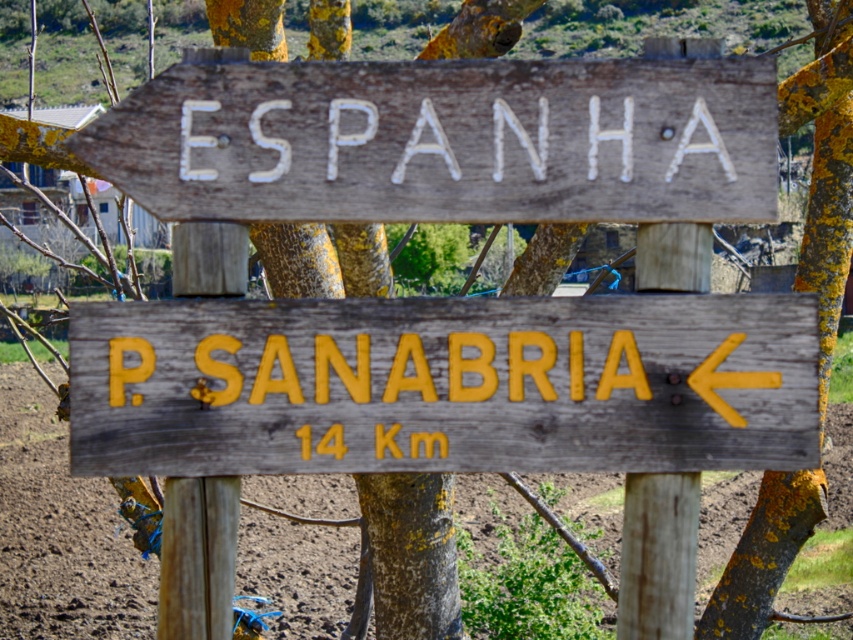
Between point (132, 356) and point (206, 164), which one is positioned in front?

Point (132, 356)

Does yellow painted wood sign at center appear over wooden sign at upper center?

Actually, yellow painted wood sign at center is below wooden sign at upper center.

Is point (772, 349) more distant than point (354, 129)?

Yes.

Find the location of a particular element. yellow painted wood sign at center is located at coordinates (444, 385).

Looking at this image, who is higher up, wooden sign at upper center or brown soil at lower left?

wooden sign at upper center is above.

Between point (131, 189) and point (33, 481), which one is positioned behind?

The point (33, 481) is more distant.

Does point (596, 152) come behind point (41, 412)?

No, it is in front of (41, 412).

You are a GUI agent. You are given a task and a screenshot of the screen. Output one action in this format:
    pyautogui.click(x=<x>, y=<y>)
    Task: Click on the wooden sign at upper center
    The image size is (853, 640).
    Given the screenshot: What is the action you would take?
    pos(445,140)

Does yellow painted wood sign at center have a lesser height compared to brown soil at lower left?

Correct, yellow painted wood sign at center is not as tall as brown soil at lower left.

Is yellow painted wood sign at center to the left of brown soil at lower left from the viewer's perspective?

Indeed, yellow painted wood sign at center is positioned on the left side of brown soil at lower left.

Which is in front, point (753, 452) or point (706, 536)?

Positioned in front is point (753, 452).

Identify the location of yellow painted wood sign at center. (444, 385).